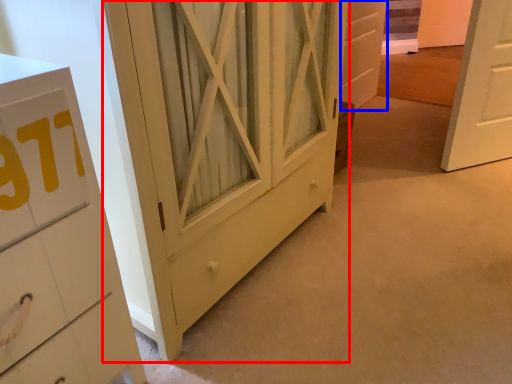
Question: Which of the following is the farthest to the observer, barn door (highlighted by a red box) or door (highlighted by a blue box)?

Choices:
 (A) barn door
 (B) door

Answer: (B)